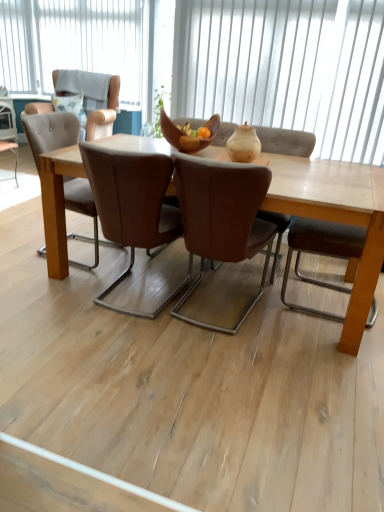
Question: Can you confirm if white vertical blinds at upper center, the first window in the back-to-front sequence, is taller than wooden bowl at center?

Choices:
 (A) no
 (B) yes

Answer: (B)

Question: Can we say white vertical blinds at upper center, placed as the second window when sorted from bottom to top, lies outside wooden bowl at center?

Choices:
 (A) no
 (B) yes

Answer: (B)

Question: Can you confirm if white vertical blinds at upper center, the first window in the back-to-front sequence, is wider than wooden bowl at center?

Choices:
 (A) no
 (B) yes

Answer: (A)

Question: Considering the relative positions of white vertical blinds at upper center, which ranks as the second window in front-to-back order, and wooden bowl at center in the image provided, is white vertical blinds at upper center, which ranks as the second window in front-to-back order, behind wooden bowl at center?

Choices:
 (A) yes
 (B) no

Answer: (A)

Question: From the image's perspective, does white vertical blinds at upper center, the 1th window from the top, appear lower than wooden bowl at center?

Choices:
 (A) no
 (B) yes

Answer: (A)

Question: Is white vertical blinds at upper center, which ranks as the second window in front-to-back order, not close to wooden bowl at center?

Choices:
 (A) no
 (B) yes

Answer: (B)

Question: Is brown leather chair at center, which is counted as the 1th chair, starting from the right, thinner than wooden bowl at center?

Choices:
 (A) no
 (B) yes

Answer: (A)

Question: Is brown leather chair at center, which is the 2th chair in left-to-right order, positioned with its back to wooden bowl at center?

Choices:
 (A) yes
 (B) no

Answer: (B)

Question: Is brown leather chair at center, which is counted as the 1th chair, starting from the right, located outside wooden bowl at center?

Choices:
 (A) yes
 (B) no

Answer: (A)

Question: Is brown leather chair at center, which is the 2th chair in left-to-right order, at the left side of wooden bowl at center?

Choices:
 (A) yes
 (B) no

Answer: (B)

Question: Can you confirm if brown leather chair at center, which is counted as the 1th chair, starting from the right, is wider than wooden bowl at center?

Choices:
 (A) no
 (B) yes

Answer: (B)

Question: From the image's perspective, would you say brown leather chair at center, which is counted as the 1th chair, starting from the right, is shown under wooden bowl at center?

Choices:
 (A) yes
 (B) no

Answer: (A)

Question: Is white vertical blinds at upper center, the 2th window positioned from the back, facing towards wooden bowl at center?

Choices:
 (A) no
 (B) yes

Answer: (B)